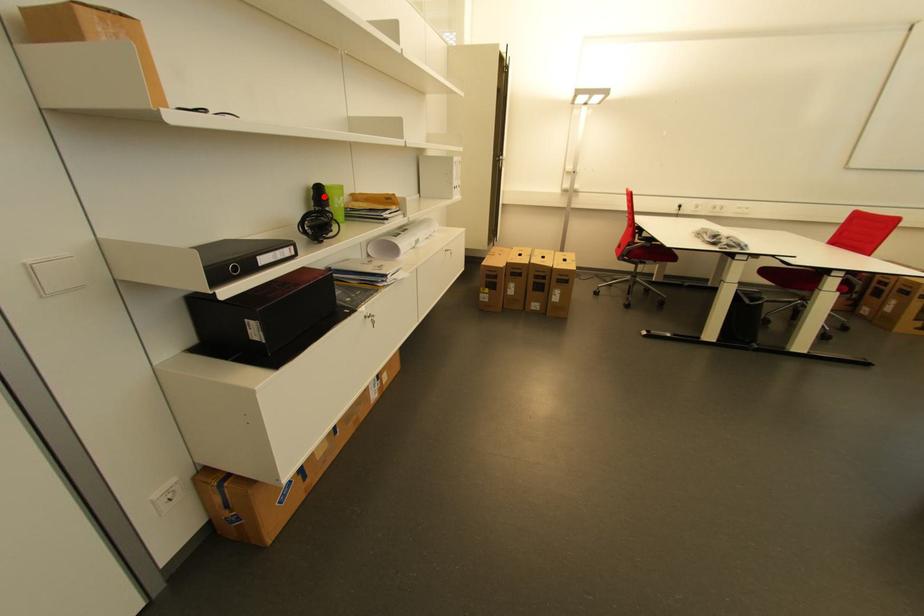
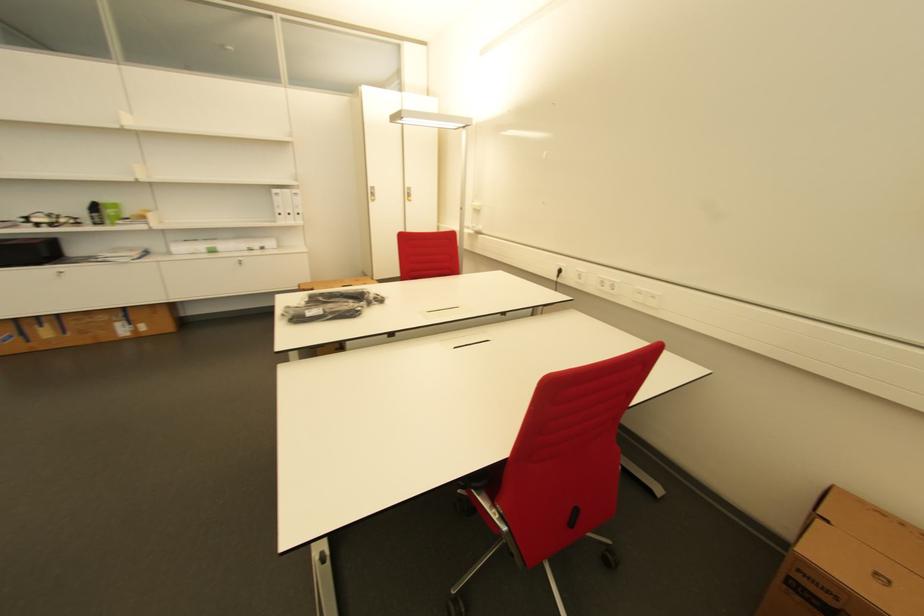
The point at the highlighted location is marked in the first image. Where is the corresponding point in the second image?

(100, 209)